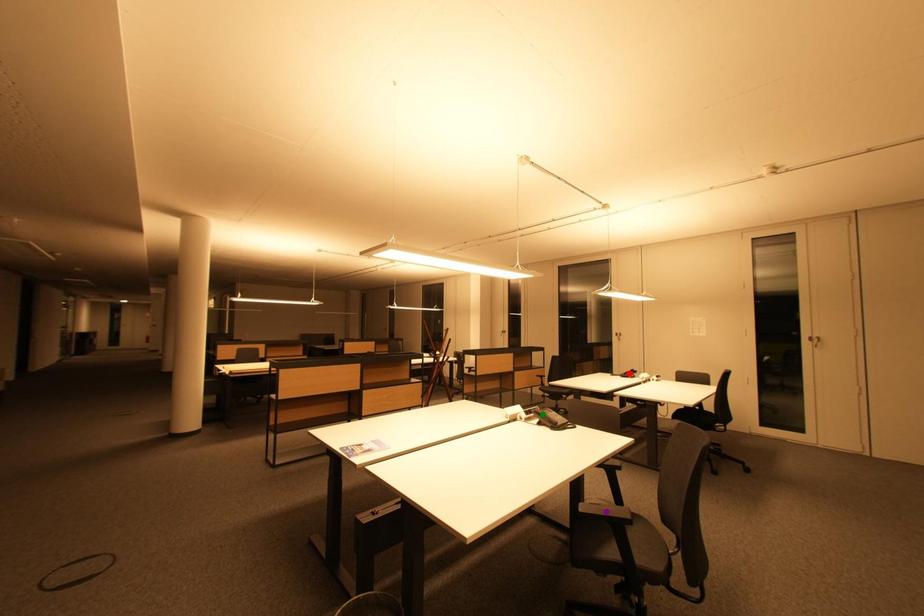
Order these from nearest to farthest:
red point | purple point | green point

purple point, green point, red point